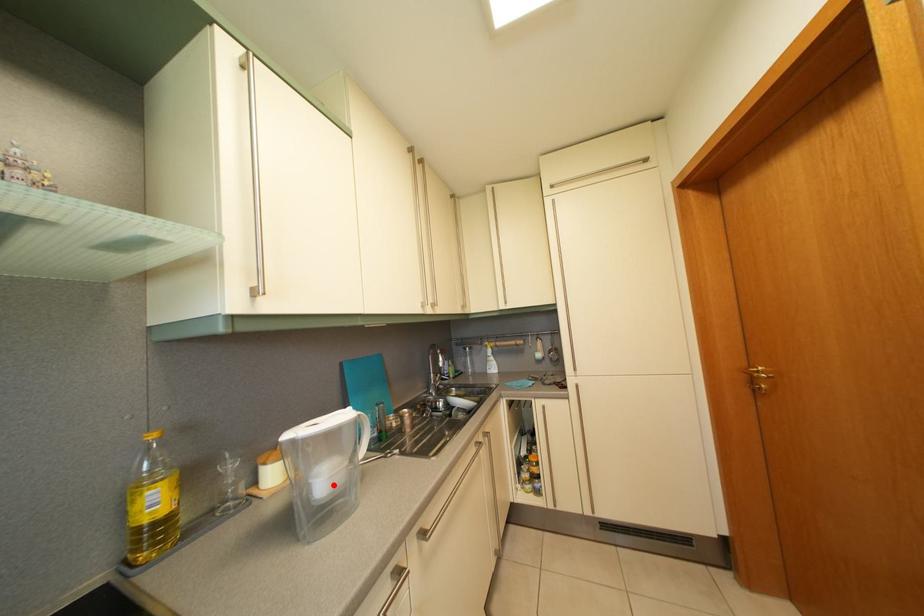
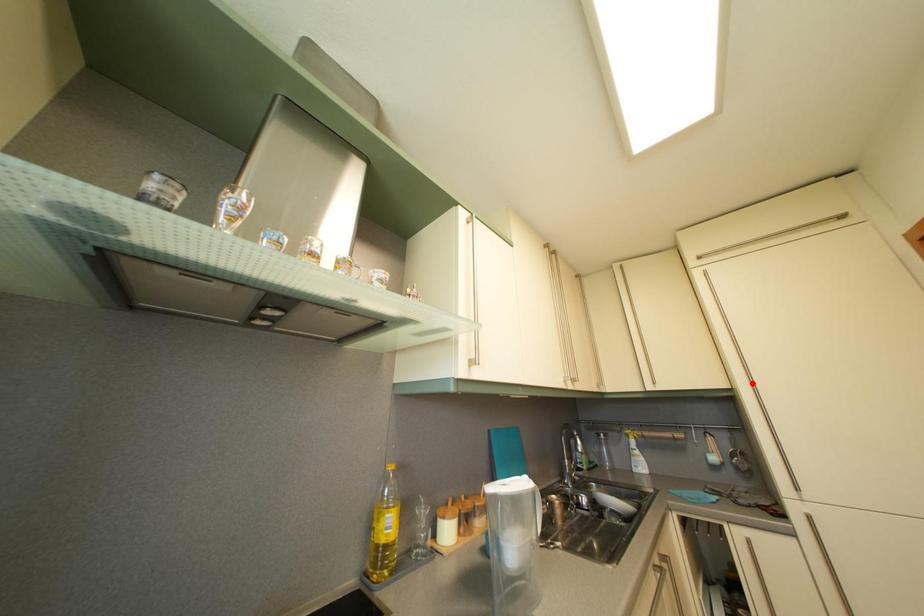
I am providing you with two images of the same scene from different viewpoints. A red point is marked on the first image and another point is marked on the second image. Do the highlighted points in image1 and image2 indicate the same real-world spot?

No